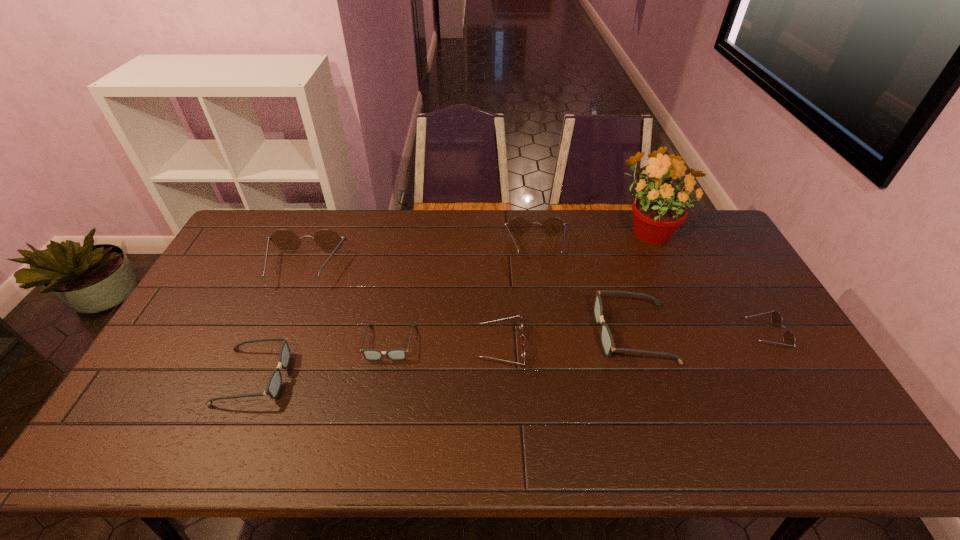
You are a GUI agent. You are given a task and a screenshot of the screen. Output one action in this format:
    pyautogui.click(x=<x>, y=<y>)
    Task: Click on the flowerpot
    
    Given the screenshot: What is the action you would take?
    pyautogui.click(x=658, y=210)

Where is `the tallest object`? Image resolution: width=960 pixels, height=540 pixels. the tallest object is located at coordinates (658, 210).

What are the coordinates of `the leftmost yellow spectacles` in the screenshot? It's located at (329, 240).

Where is `the tallest spectacles`? Image resolution: width=960 pixels, height=540 pixels. the tallest spectacles is located at coordinates (329, 240).

Locate an element on the screen. The width and height of the screenshot is (960, 540). the third smallest yellow spectacles is located at coordinates (518, 226).

Where is `the biggest gray spectacles`? Image resolution: width=960 pixels, height=540 pixels. the biggest gray spectacles is located at coordinates (607, 342).

You are a GUI agent. You are given a task and a screenshot of the screen. Output one action in this format:
    pyautogui.click(x=<x>, y=<y>)
    Task: Click on the rightmost gray spectacles
    
    Given the screenshot: What is the action you would take?
    pyautogui.click(x=607, y=342)

Locate an element on the screen. the third biggest yellow spectacles is located at coordinates (521, 326).

Identify the location of the leftmost gray spectacles. (274, 384).

Where is `the rightmost spectacles`? The image size is (960, 540). the rightmost spectacles is located at coordinates (789, 339).